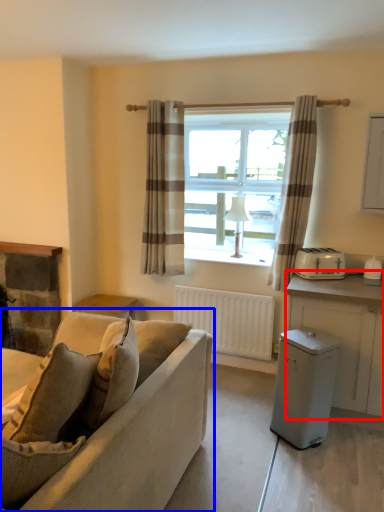
Question: Which point is closer to the camera, cabinetry (highlighted by a red box) or studio couch (highlighted by a blue box)?

Choices:
 (A) cabinetry
 (B) studio couch

Answer: (B)